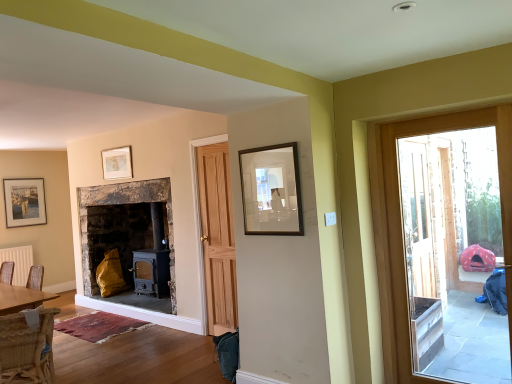
Question: Is white matte radiator at lower left not within wooden frame at upper center, acting as the third picture frame starting from the left?

Choices:
 (A) no
 (B) yes

Answer: (B)

Question: Can you confirm if white matte radiator at lower left is thinner than wooden frame at upper center, acting as the 3th picture frame starting from the back?

Choices:
 (A) no
 (B) yes

Answer: (A)

Question: Does white matte radiator at lower left appear on the left side of wooden frame at upper center, acting as the 3th picture frame starting from the back?

Choices:
 (A) yes
 (B) no

Answer: (A)

Question: Considering the relative sizes of white matte radiator at lower left and wooden frame at upper center, acting as the third picture frame starting from the left, in the image provided, is white matte radiator at lower left shorter than wooden frame at upper center, acting as the third picture frame starting from the left,?

Choices:
 (A) yes
 (B) no

Answer: (B)

Question: Is white matte radiator at lower left facing away from wooden frame at upper center, acting as the third picture frame starting from the left?

Choices:
 (A) no
 (B) yes

Answer: (A)

Question: From the image's perspective, is wooden frame at upper center, the 1th picture frame when ordered from front to back, above or below woven wicker chair at lower left?

Choices:
 (A) above
 (B) below

Answer: (A)

Question: In the image, is wooden frame at upper center, the 1th picture frame when ordered from front to back, on the left side or the right side of woven wicker chair at lower left?

Choices:
 (A) left
 (B) right

Answer: (B)

Question: Is wooden frame at upper center, which ranks as the first picture frame in right-to-left order, bigger or smaller than woven wicker chair at lower left?

Choices:
 (A) small
 (B) big

Answer: (A)

Question: In terms of width, does wooden frame at upper center, which ranks as the first picture frame in right-to-left order, look wider or thinner when compared to woven wicker chair at lower left?

Choices:
 (A) wide
 (B) thin

Answer: (B)

Question: From a real-world perspective, relative to white matte radiator at lower left, is wooden frame at upper center, which ranks as the first picture frame in right-to-left order, vertically above or below?

Choices:
 (A) below
 (B) above

Answer: (B)

Question: From the image's perspective, is wooden frame at upper center, acting as the third picture frame starting from the left, positioned above or below white matte radiator at lower left?

Choices:
 (A) below
 (B) above

Answer: (B)

Question: Is point (259, 216) closer or farther from the camera than point (13, 254)?

Choices:
 (A) farther
 (B) closer

Answer: (B)

Question: Looking at their shapes, would you say wooden frame at upper center, acting as the 3th picture frame starting from the back, is wider or thinner than white matte radiator at lower left?

Choices:
 (A) thin
 (B) wide

Answer: (A)

Question: Relative to wooden frame at upper center, which ranks as the first picture frame in right-to-left order, is wooden door at right in front or behind?

Choices:
 (A) front
 (B) behind

Answer: (A)

Question: Is point (506, 306) positioned closer to the camera than point (280, 160)?

Choices:
 (A) closer
 (B) farther

Answer: (B)